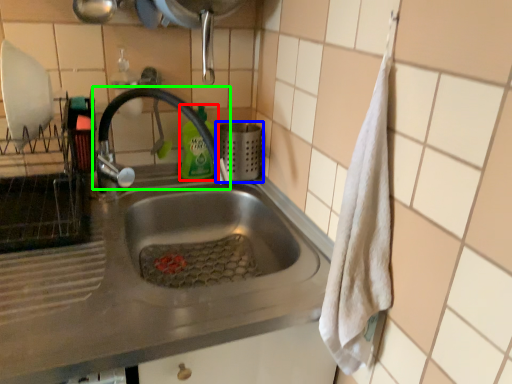
Question: Considering the real-world distances, which object is closest to cleaning product (highlighted by a red box)? appliance (highlighted by a blue box) or tap (highlighted by a green box).

Choices:
 (A) appliance
 (B) tap

Answer: (A)